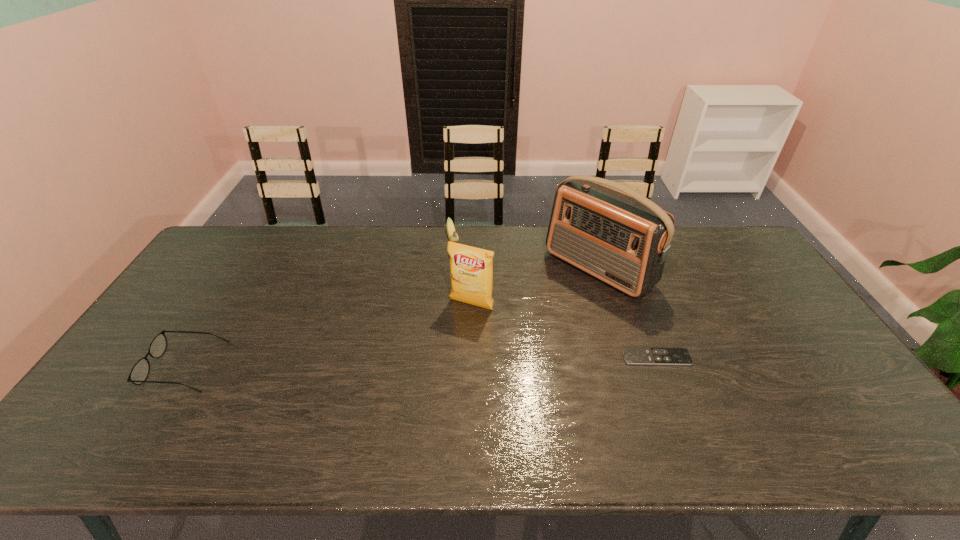
The height and width of the screenshot is (540, 960). What are the coordinates of `free spot on the desktop that is between the second shortest object and the shortest object and is positioned on the front of the crisp (potato chip) with the logo` in the screenshot? It's located at (440, 361).

The height and width of the screenshot is (540, 960). I want to click on free space on the desktop that is between the second shortest object and the remote control and is positioned on the front-facing side of the tallest object, so [x=489, y=360].

Locate an element on the screen. free space on the desktop that is between the leftmost object and the remote control and is positioned at the stem of the banana is located at coordinates (485, 361).